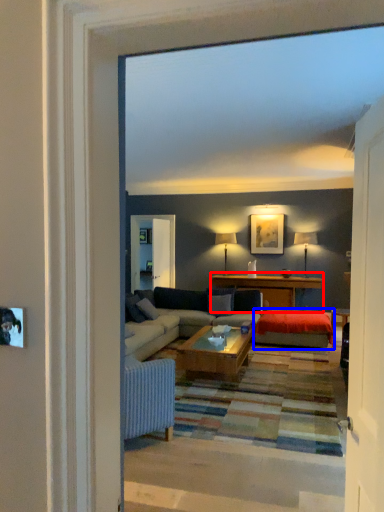
Question: Which object is closer to the camera taking this photo, table (highlighted by a red box) or wide (highlighted by a blue box)?

Choices:
 (A) table
 (B) wide

Answer: (B)